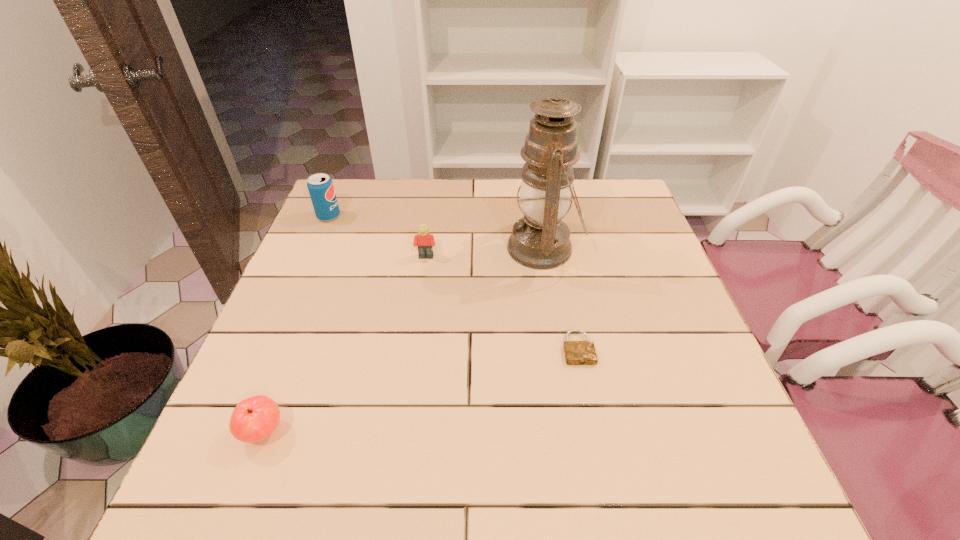
The image size is (960, 540). In the image, there is a desktop. Find the location of `vacant space at the far left corner`. vacant space at the far left corner is located at coordinates (349, 205).

In the image, there is a desktop. Identify the location of vacant space at the far right corner. (611, 220).

Locate an element on the screen. This screenshot has height=540, width=960. free space between the second nearest object and the fourth tallest object is located at coordinates (420, 390).

The image size is (960, 540). I want to click on free spot between the apple and the second nearest object, so click(420, 390).

This screenshot has height=540, width=960. I want to click on empty space that is in between the padlock and the soda can, so click(x=453, y=282).

Locate an element on the screen. The image size is (960, 540). unoccupied area between the padlock and the tallest object is located at coordinates (561, 298).

This screenshot has width=960, height=540. Find the location of `free spot between the tallest object and the Lego`. free spot between the tallest object and the Lego is located at coordinates (485, 253).

Identify the location of unoccupied area between the Lego and the shortest object. (502, 302).

You are a GUI agent. You are given a task and a screenshot of the screen. Output one action in this format:
    pyautogui.click(x=<x>, y=<y>)
    Task: Click on the free space between the soda can and the fourth farthest object
    
    Given the screenshot: What is the action you would take?
    pyautogui.click(x=453, y=282)

Find the location of a particular element. free space between the third object from left to right and the shortest object is located at coordinates [x=502, y=302].